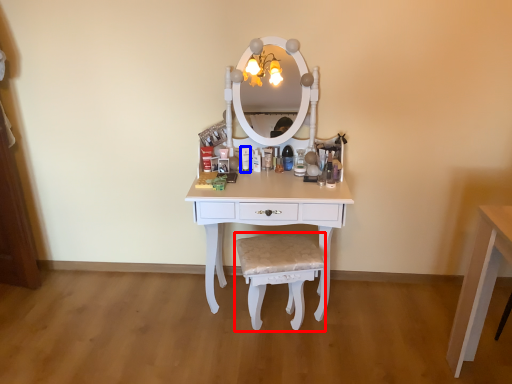
Question: Among these objects, which one is nearest to the camera, chair (highlighted by a red box) or toiletry (highlighted by a blue box)?

Choices:
 (A) chair
 (B) toiletry

Answer: (A)